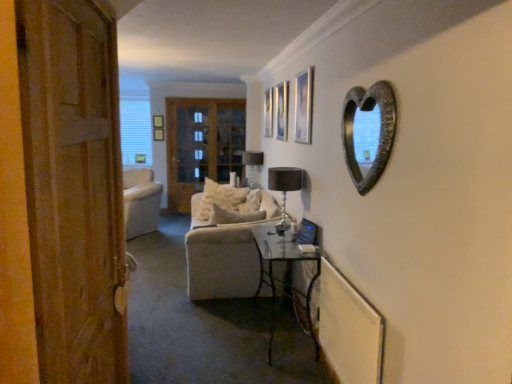
Question: Can you confirm if black glass lamp at center, which appears as the 1th lamp when viewed from the right, is taller than rustic wood heart-shaped mirror at upper right?

Choices:
 (A) yes
 (B) no

Answer: (B)

Question: Is black glass lamp at center, the 2th lamp viewed from the left, oriented towards rustic wood heart-shaped mirror at upper right?

Choices:
 (A) yes
 (B) no

Answer: (B)

Question: Can you confirm if black glass lamp at center, which appears as the 1th lamp when viewed from the front, is positioned to the right of rustic wood heart-shaped mirror at upper right?

Choices:
 (A) yes
 (B) no

Answer: (B)

Question: From the image's perspective, is black glass lamp at center, which appears as the 1th lamp when viewed from the front, on rustic wood heart-shaped mirror at upper right?

Choices:
 (A) no
 (B) yes

Answer: (A)

Question: Is black glass lamp at center, which appears as the 1th lamp when viewed from the right, outside of rustic wood heart-shaped mirror at upper right?

Choices:
 (A) no
 (B) yes

Answer: (B)

Question: Are black glass lamp at center, which appears as the 1th lamp when viewed from the front, and rustic wood heart-shaped mirror at upper right located far from each other?

Choices:
 (A) no
 (B) yes

Answer: (B)

Question: Is metallic silver picture frame at upper center, which is the second picture frame from left to right, oriented away from clear glass door at center?

Choices:
 (A) no
 (B) yes

Answer: (A)

Question: Does metallic silver picture frame at upper center, which is the second picture frame from left to right, touch clear glass door at center?

Choices:
 (A) yes
 (B) no

Answer: (B)

Question: Is metallic silver picture frame at upper center, positioned as the 2th picture frame in right-to-left order, not near clear glass door at center?

Choices:
 (A) no
 (B) yes

Answer: (B)

Question: Can you confirm if metallic silver picture frame at upper center, the second picture frame viewed from the back, is wider than clear glass door at center?

Choices:
 (A) no
 (B) yes

Answer: (B)

Question: Can you confirm if metallic silver picture frame at upper center, which is the second picture frame from left to right, is taller than clear glass door at center?

Choices:
 (A) yes
 (B) no

Answer: (B)

Question: Can you confirm if metallic silver picture frame at upper center, the second picture frame viewed from the back, is smaller than clear glass door at center?

Choices:
 (A) yes
 (B) no

Answer: (A)

Question: Is clear glass door at center not inside matte black lampshade at center, positioned as the 1th lamp in left-to-right order?

Choices:
 (A) no
 (B) yes

Answer: (B)